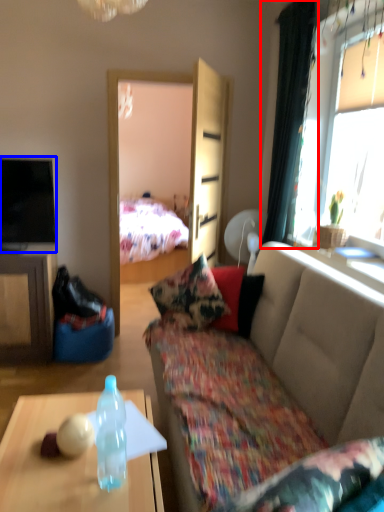
Question: Which object appears closest to the camera in this image, curtain (highlighted by a red box) or television (highlighted by a blue box)?

Choices:
 (A) curtain
 (B) television

Answer: (A)